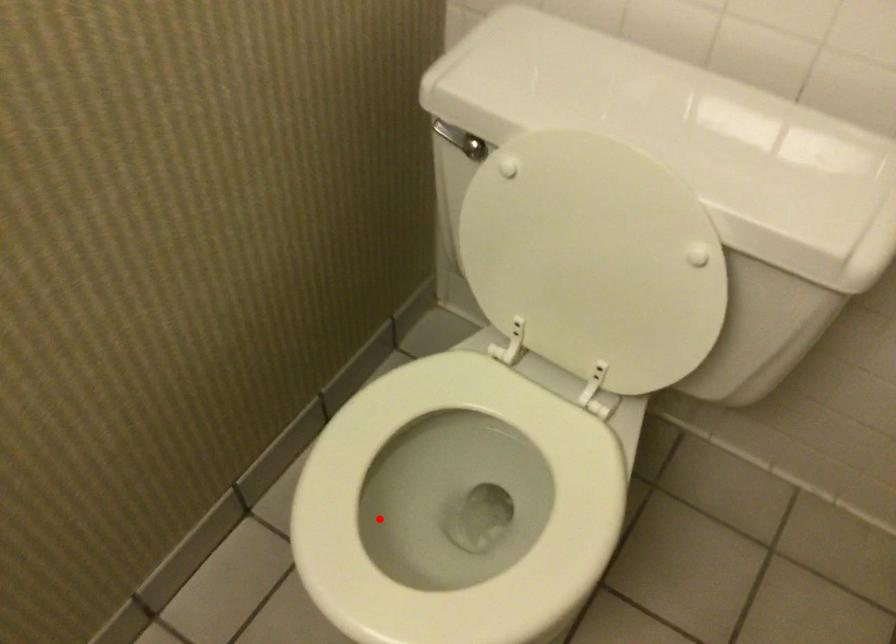
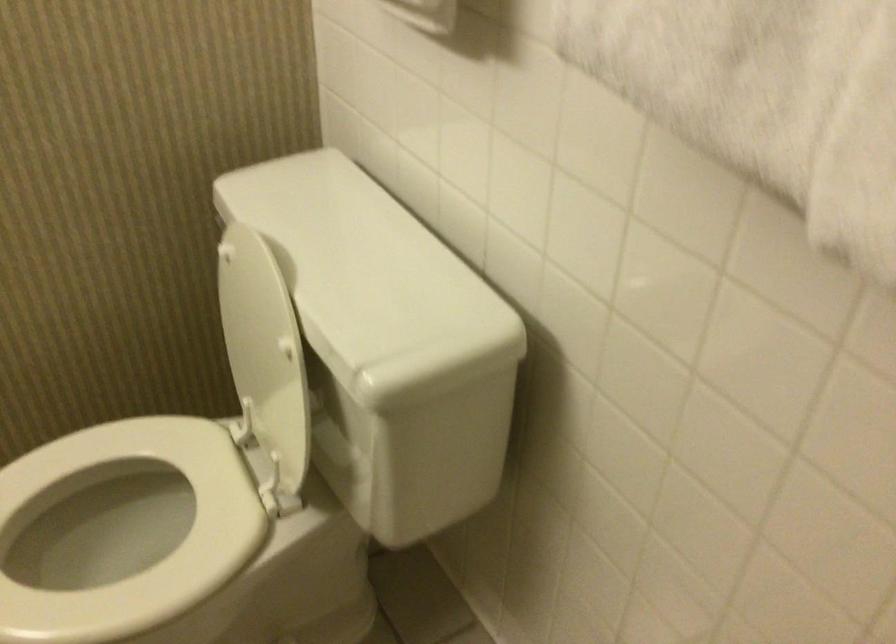
Find the pixel in the second image that matches the highlighted location in the first image.

(97, 545)